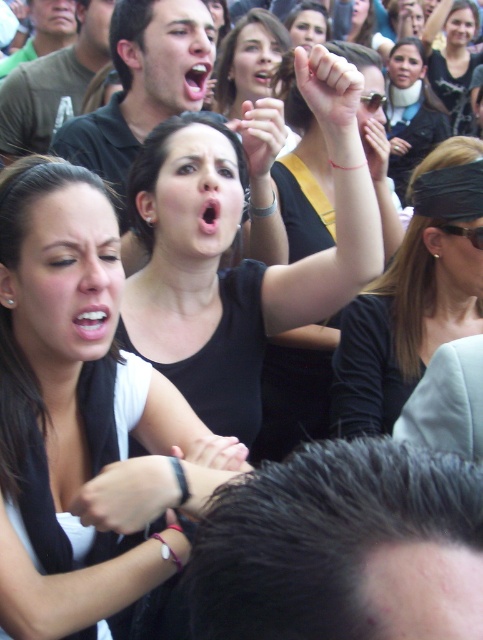
Which of these two, black leather wristband at lower center or white skin at raised fist, stands taller?

white skin at raised fist

Does black leather wristband at lower center have a smaller size compared to white skin at raised fist?

Yes, black leather wristband at lower center is smaller than white skin at raised fist.

Between point (111, 492) and point (287, 54), which one is positioned behind?

Point (287, 54)

Identify the location of black leather wristband at lower center. Image resolution: width=483 pixels, height=640 pixels. (127, 493).

Who is more distant from viewer, [48,330] or [267,170]?

Point [267,170]

What do you see at coordinates (72, 406) in the screenshot?
I see `black matte shirt at upper center` at bounding box center [72, 406].

At what (x,y) coordinates should I click in order to perform the action: click on black matte shirt at upper center. Please return your answer as a coordinate pair (x, y). Looking at the image, I should click on (72, 406).

From the picture: Is black matte shirt at upper center thinner than black bandana at upper right?

Yes.

Describe the element at coordinates (72, 406) in the screenshot. The width and height of the screenshot is (483, 640). I see `black matte shirt at upper center` at that location.

Locate an element on the screen. The image size is (483, 640). black matte shirt at upper center is located at coordinates (72, 406).